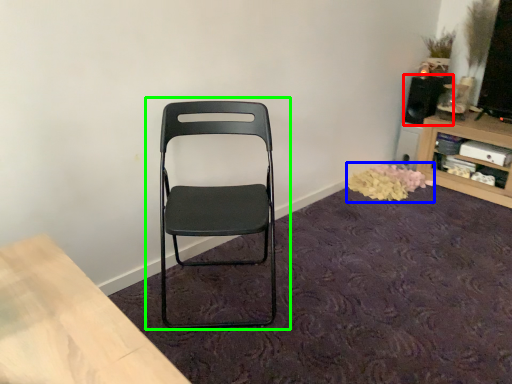
Question: Which object is positioned closest to speaker (highlighted by a red box)? Select from flower (highlighted by a blue box) and chair (highlighted by a green box).

Choices:
 (A) flower
 (B) chair

Answer: (A)